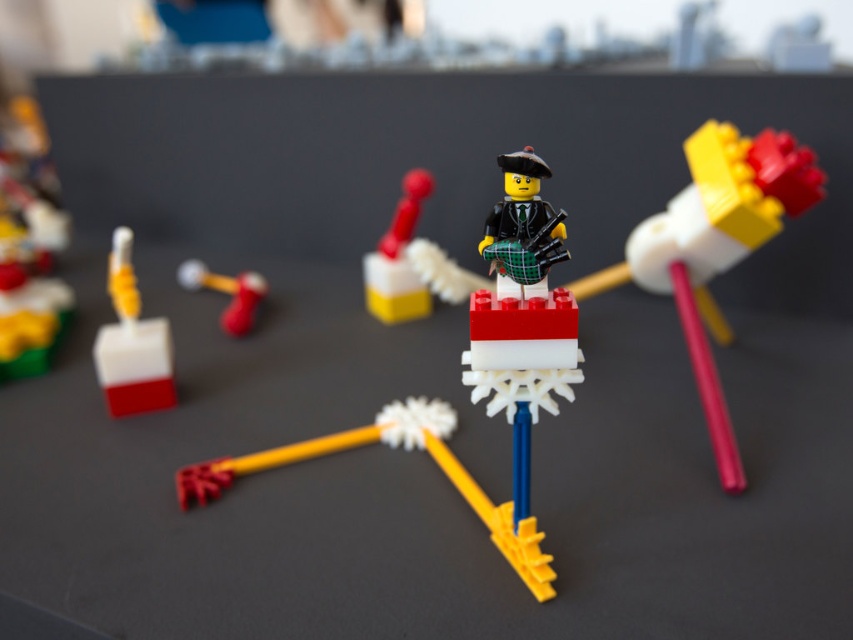
Question: Which point is farther to the camera?

Choices:
 (A) brick-like white and red object at center
 (B) yellow plastic gear at center
 (C) matte yellow pencil at center

Answer: (C)

Question: In this image, where is brick-like white and red object at center located relative to smooth white block at center?

Choices:
 (A) below
 (B) above

Answer: (A)

Question: Estimate the real-world distances between objects in this image. Which object is farther from the brick-like white and red object at center?

Choices:
 (A) white matte block at left
 (B) smooth white block at center

Answer: (A)

Question: Which of the following is the closest to the observer?

Choices:
 (A) (405, 236)
 (B) (122, 282)
 (C) (521, 548)
 (D) (757, 177)

Answer: (C)

Question: Does yellow plastic gear at center have a larger size compared to smooth white block at center?

Choices:
 (A) yes
 (B) no

Answer: (A)

Question: Can you confirm if yellow plastic gear at center is positioned to the left of smooth white block at center?

Choices:
 (A) yes
 (B) no

Answer: (B)